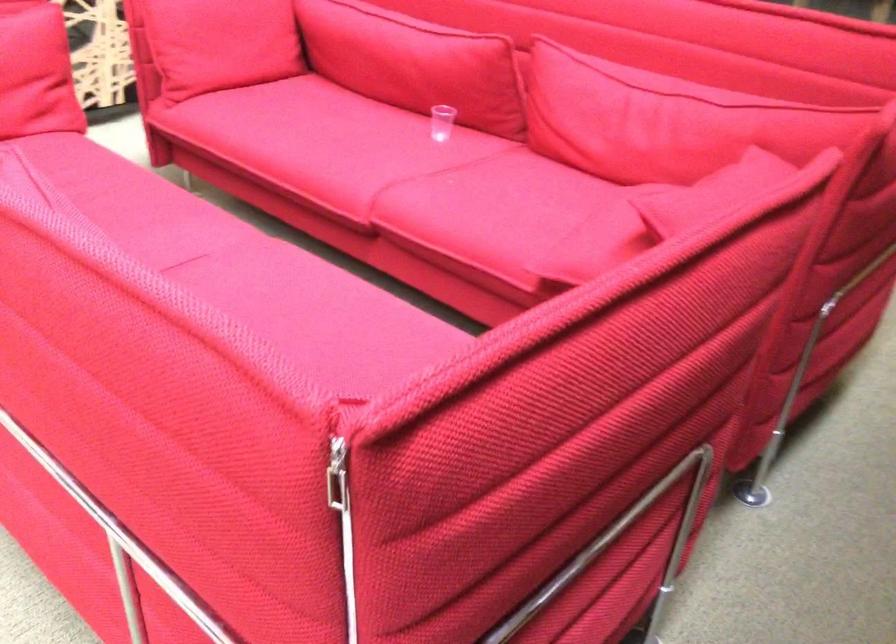
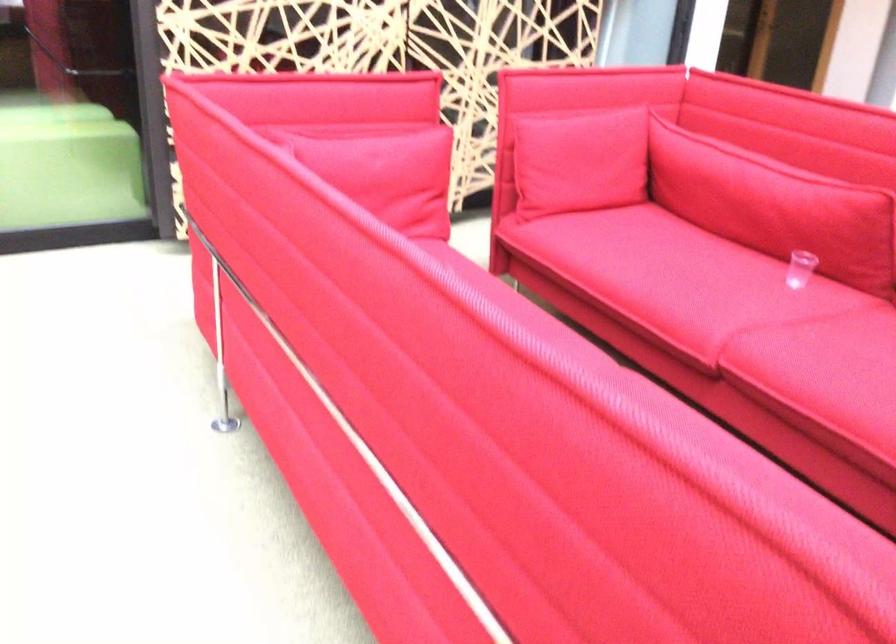
Question: What movement of the cameraman would produce the second image?

Choices:
 (A) Left
 (B) Right
 (C) Forward
 (D) Backward

Answer: (A)